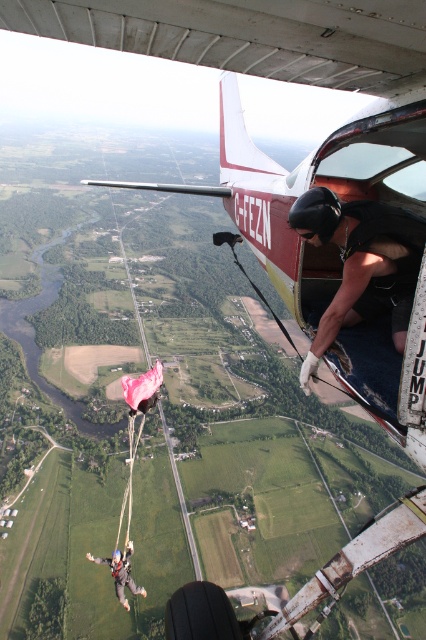
Does black matte helmet at upper center have a greater width compared to gray fabric parachute at lower left?

No.

Can you confirm if black matte helmet at upper center is bigger than gray fabric parachute at lower left?

No, black matte helmet at upper center is not bigger than gray fabric parachute at lower left.

Who is more distant from viewer, (324, 195) or (112, 572)?

Positioned behind is point (112, 572).

The image size is (426, 640). In order to click on black matte helmet at upper center in this screenshot , I will do `click(360, 262)`.